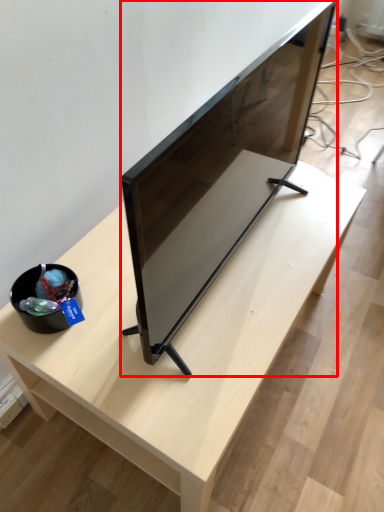
Question: From the image's perspective, considering the relative positions of television (annotated by the red box) and table in the image provided, where is television (annotated by the red box) located with respect to the staircase?

Choices:
 (A) above
 (B) below

Answer: (A)